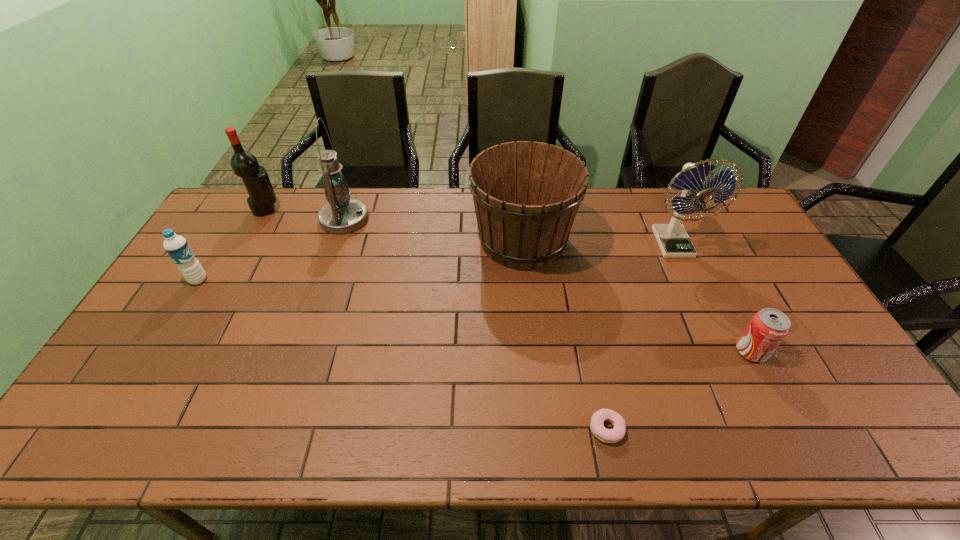
What are the coordinates of `free space located 0.060m on the right of the oil lamp` in the screenshot? It's located at (386, 220).

Find the location of a particular element. The height and width of the screenshot is (540, 960). vacant space located on the front-facing side of the fan is located at coordinates (716, 339).

Find the location of a particular element. The image size is (960, 540). vacant space located on the back of the second object from left to right is located at coordinates (276, 192).

The height and width of the screenshot is (540, 960). In order to click on free region located 0.400m on the right of the fourth tallest object in this screenshot , I will do `click(694, 240)`.

The image size is (960, 540). Identify the location of blank space located on the label of the water bottle. (293, 280).

The height and width of the screenshot is (540, 960). What are the coordinates of `vacant point located 0.110m on the front of the second shortest object` in the screenshot? It's located at (779, 403).

Locate an element on the screen. vacant space located 0.190m on the right of the shortest object is located at coordinates (706, 429).

Locate an element on the screen. oil lamp present at the far edge is located at coordinates (342, 215).

The image size is (960, 540). I want to click on fan located at the far edge, so click(673, 240).

Identify the location of wine bottle that is positioned at the far edge. (244, 164).